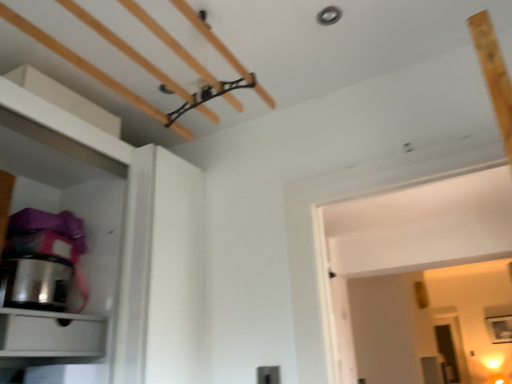
Question: Considering the relative positions of stainless steel pot at left and matte white drawer at lower left in the image provided, is stainless steel pot at left to the left of matte white drawer at lower left from the viewer's perspective?

Choices:
 (A) no
 (B) yes

Answer: (B)

Question: Can you confirm if stainless steel pot at left is bigger than matte white drawer at lower left?

Choices:
 (A) yes
 (B) no

Answer: (A)

Question: Could matte white drawer at lower left be considered to be inside stainless steel pot at left?

Choices:
 (A) yes
 (B) no

Answer: (B)

Question: Is stainless steel pot at left far away from matte white drawer at lower left?

Choices:
 (A) no
 (B) yes

Answer: (A)

Question: Is stainless steel pot at left not within matte white drawer at lower left?

Choices:
 (A) yes
 (B) no

Answer: (A)

Question: Are stainless steel pot at left and matte white drawer at lower left making contact?

Choices:
 (A) yes
 (B) no

Answer: (B)

Question: Is matte white drawer at lower left oriented towards stainless steel pot at left?

Choices:
 (A) no
 (B) yes

Answer: (A)

Question: Are matte white drawer at lower left and stainless steel pot at left beside each other?

Choices:
 (A) no
 (B) yes

Answer: (A)

Question: Can you confirm if matte white drawer at lower left is positioned to the left of stainless steel pot at left?

Choices:
 (A) no
 (B) yes

Answer: (A)

Question: Is stainless steel pot at left a part of matte white drawer at lower left?

Choices:
 (A) no
 (B) yes

Answer: (A)

Question: Does matte white drawer at lower left lie behind stainless steel pot at left?

Choices:
 (A) yes
 (B) no

Answer: (B)

Question: Considering the relative sizes of matte white drawer at lower left and stainless steel pot at left in the image provided, is matte white drawer at lower left smaller than stainless steel pot at left?

Choices:
 (A) no
 (B) yes

Answer: (B)

Question: Considering the positions of stainless steel pot at left and matte white drawer at lower left in the image, is stainless steel pot at left wider or thinner than matte white drawer at lower left?

Choices:
 (A) thin
 (B) wide

Answer: (A)